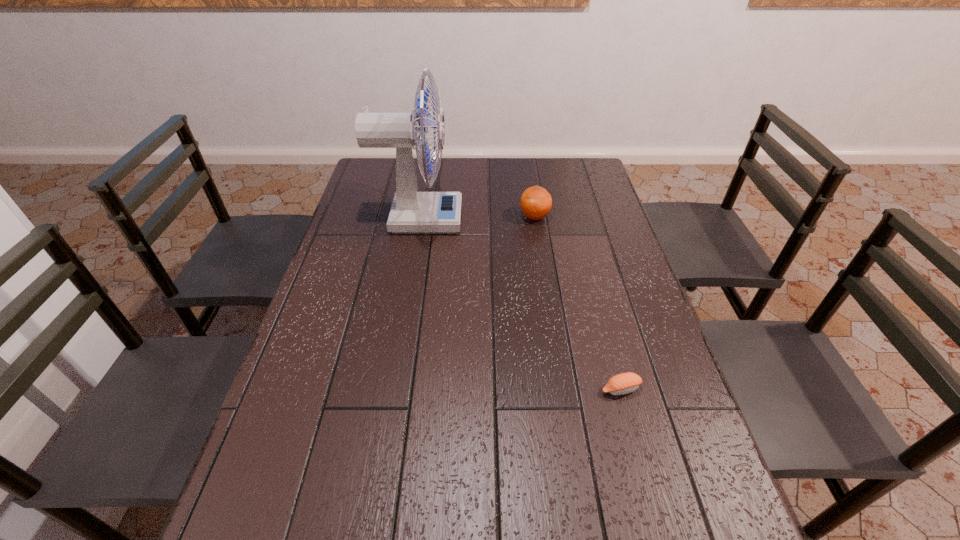
The height and width of the screenshot is (540, 960). I want to click on object at the right edge, so 624,383.

In order to click on vacant area at the far edge of the desktop in this screenshot , I will do `click(480, 180)`.

In the image, there is a desktop. What are the coordinates of `vacant space at the left edge` in the screenshot? It's located at (281, 487).

The height and width of the screenshot is (540, 960). I want to click on free location at the right edge of the desktop, so click(603, 300).

The image size is (960, 540). Identify the location of free space at the far right corner. (594, 187).

Find the location of a particular element. vacant space in between the shortest object and the orange is located at coordinates (578, 303).

Identify the location of vacant space in between the shortest object and the fan. (519, 304).

Find the location of a particular element. The image size is (960, 540). blank region between the sushi and the second shortest object is located at coordinates (578, 303).

Locate an element on the screen. This screenshot has height=540, width=960. unoccupied position between the second shortest object and the tallest object is located at coordinates [x=477, y=218].

Where is `unoccupied area between the second shortest object and the rightmost object`? unoccupied area between the second shortest object and the rightmost object is located at coordinates (578, 303).